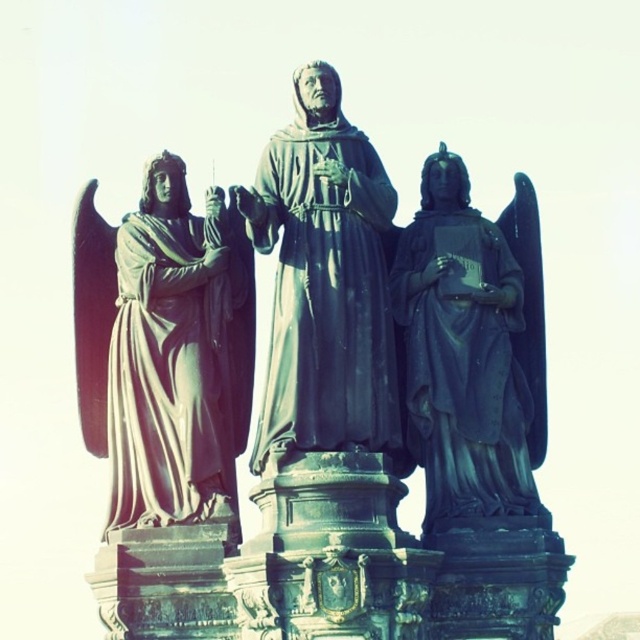
You are an art conservator assessing the statue group. You need to clean the matte black statue at right and the bronze statue at center. Based on their positions, which statue is situated lower in the arrangement?

The matte black statue at right is located below the bronze statue at center, so it is situated lower in the arrangement.

You are a tour guide explaining the statue group to visitors. You want to mention the distance between the two statues. How far apart are the matte black statue at right and the bronze statue at center?

The matte black statue at right is 18.89 feet away from the bronze statue at center.